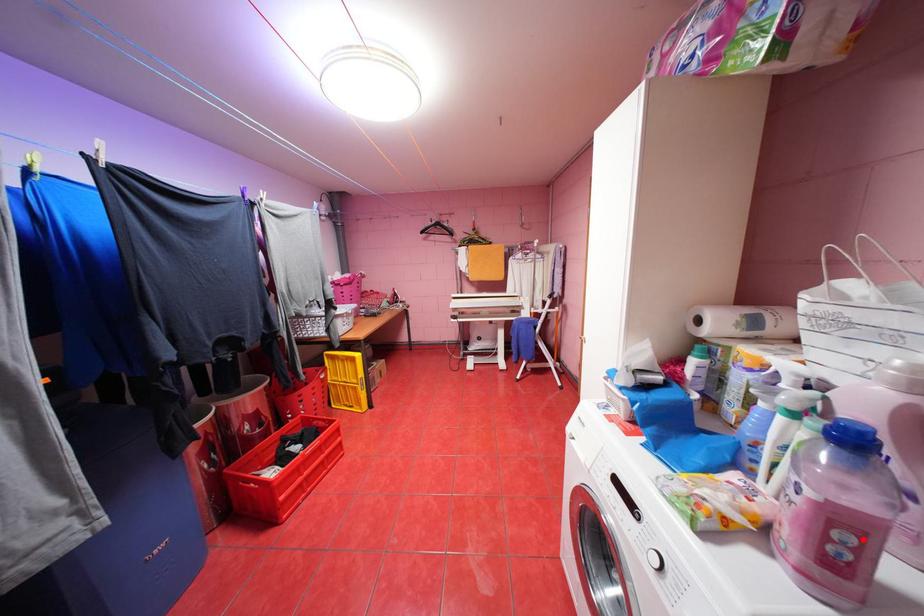
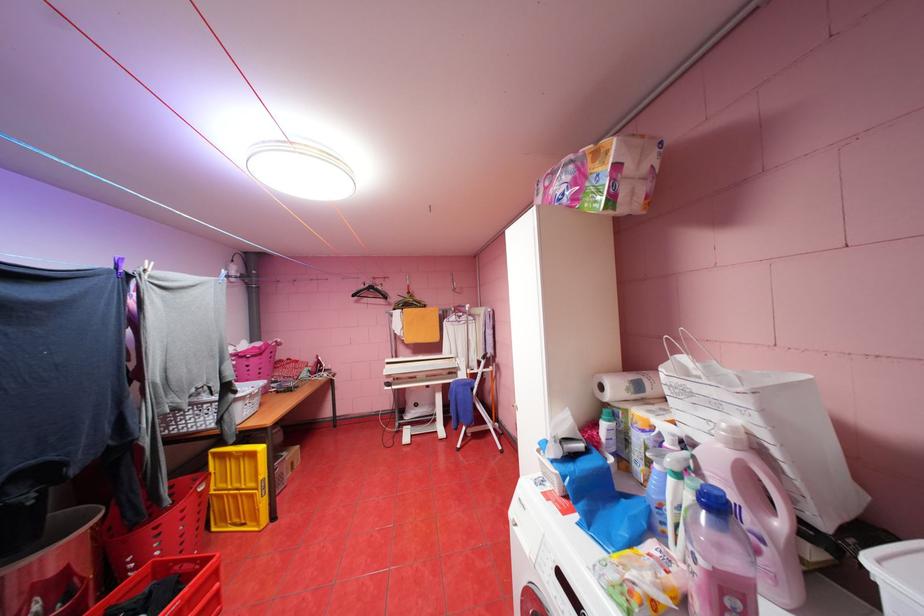
Where in the second image is the point corresponding to the highlighted location from the first image?

(748, 604)